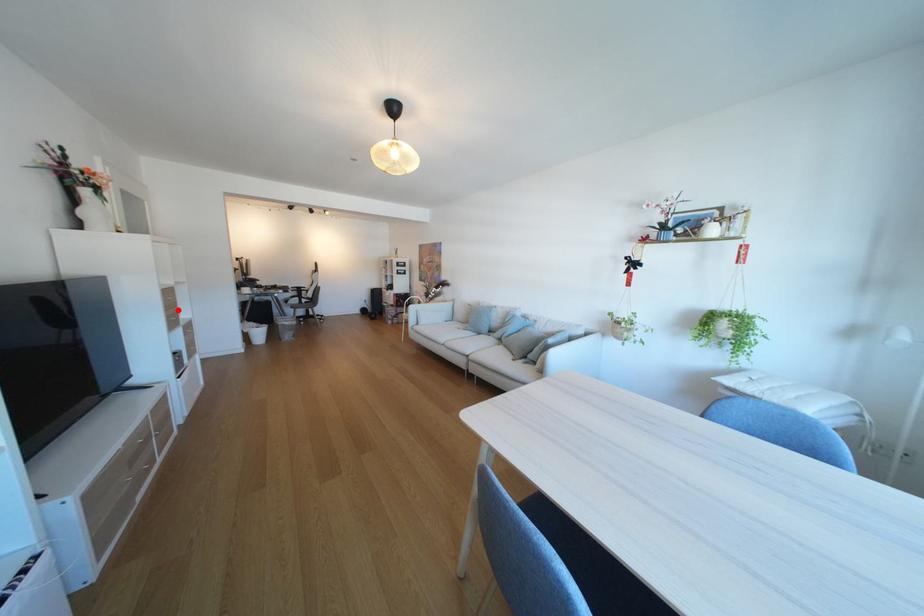
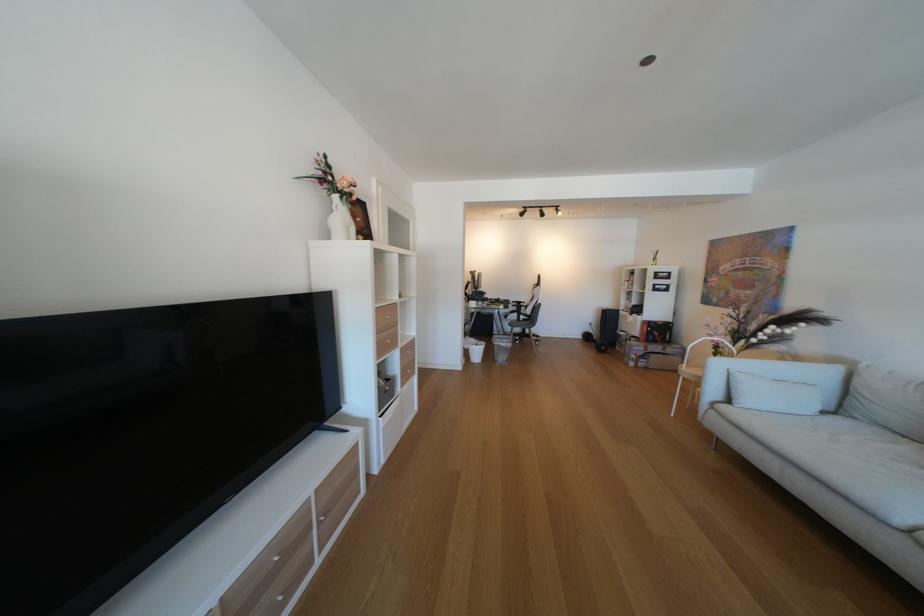
Where in the second image is the point corresponding to the highlighted location from the first image?

(390, 331)